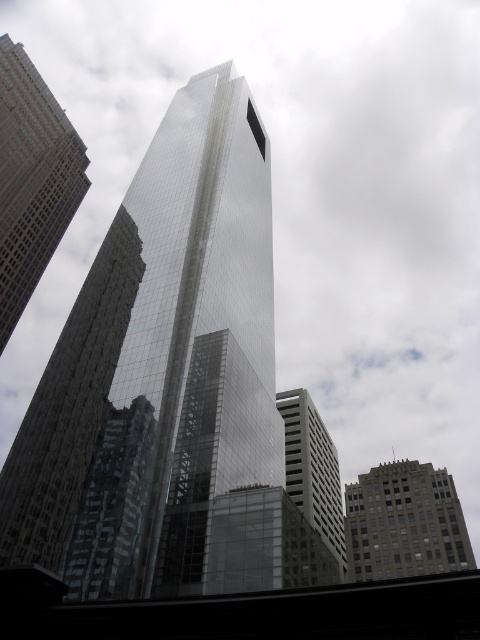
You are standing in the middle of the city square and see the point marked as point (32, 179). What does this point indicate?

The point (32, 179) marks the glassy reflective skyscraper at left.

You are an architect evaluating the urban layout. Given that the reflective glass skyscraper at center and the gray concrete building at lower right are both in the same row, which building has a greater width from an observer standing in front of them?

The reflective glass skyscraper at center has a greater width than the gray concrete building at lower right.

You are an architect evaluating the urban layout. Given the reflective glass skyscraper at center and the white glass building at center, which one would cast a larger shadow during midday? Please explain your reasoning based on their sizes.

The reflective glass skyscraper at center is larger in size compared to the white glass building at center. Since larger structures generally cast larger shadows when the sun is directly overhead, the reflective glass skyscraper at center would cast a larger shadow during midday.